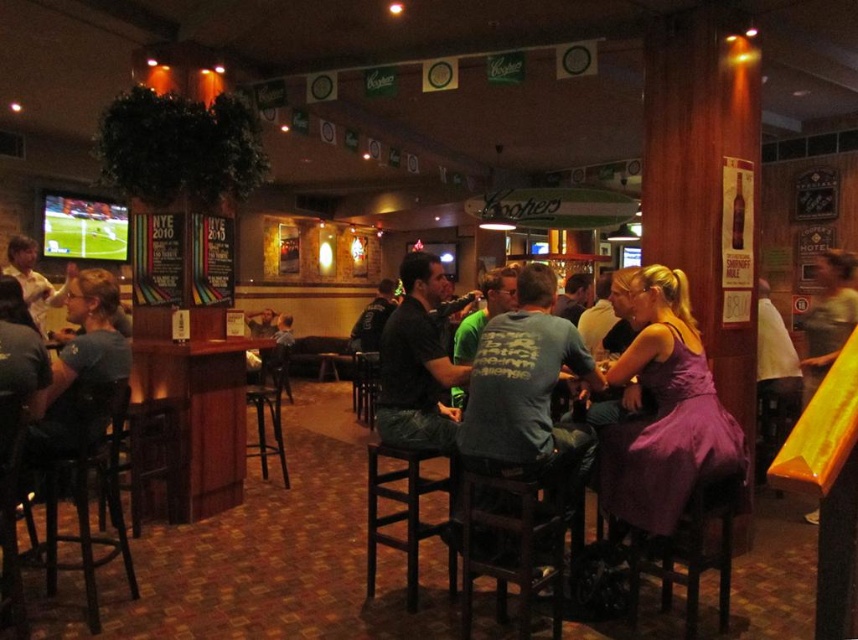
Which is more to the left, gray cotton t-shirt at center or yellow fabric at right?

gray cotton t-shirt at center

What do you see at coordinates (529, 388) in the screenshot? I see `gray cotton t-shirt at center` at bounding box center [529, 388].

Where is `gray cotton t-shirt at center`? The width and height of the screenshot is (858, 640). gray cotton t-shirt at center is located at coordinates click(x=529, y=388).

Locate an element on the screen. gray cotton t-shirt at center is located at coordinates (529, 388).

Based on the photo, does dark gray shirt at center appear on the right side of black leather jacket at center?

Yes, dark gray shirt at center is to the right of black leather jacket at center.

The width and height of the screenshot is (858, 640). What do you see at coordinates (418, 362) in the screenshot? I see `dark gray shirt at center` at bounding box center [418, 362].

The width and height of the screenshot is (858, 640). I want to click on dark gray shirt at center, so click(x=418, y=362).

At what (x,y) coordinates should I click in order to perform the action: click on dark gray shirt at center. Please return your answer as a coordinate pair (x, y). The image size is (858, 640). Looking at the image, I should click on (418, 362).

Is matte blue shirt at left thinner than black leather jacket at center?

Indeed, matte blue shirt at left has a lesser width compared to black leather jacket at center.

What do you see at coordinates (80, 362) in the screenshot?
I see `matte blue shirt at left` at bounding box center [80, 362].

This screenshot has width=858, height=640. What are the coordinates of `matte blue shirt at left` in the screenshot? It's located at point(80,362).